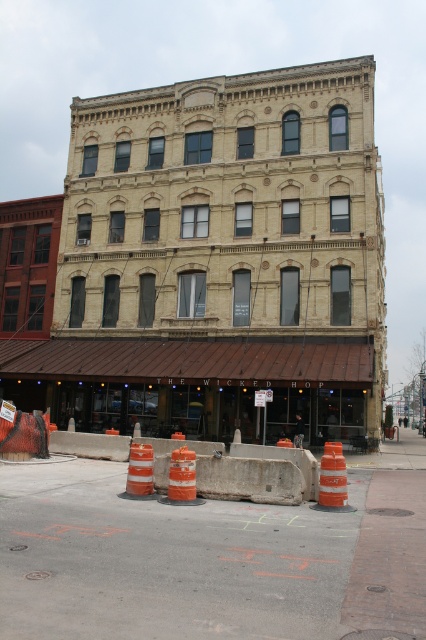
Question: Can you confirm if orange traffic cones at center is positioned to the right of orange reflective cone at center?

Choices:
 (A) no
 (B) yes

Answer: (B)

Question: Can you confirm if orange traffic cones at center is positioned above orange reflective cone at center?

Choices:
 (A) no
 (B) yes

Answer: (A)

Question: Estimate the real-world distances between objects in this image. Which object is farther from the orange reflective cone at center?

Choices:
 (A) orange traffic cones at center
 (B) concrete at center

Answer: (A)

Question: Which point is closer to the camera?

Choices:
 (A) (51, 474)
 (B) (138, 493)
 (C) (227, 486)

Answer: (B)

Question: Does orange traffic cones at center come in front of orange reflective cone at center?

Choices:
 (A) yes
 (B) no

Answer: (A)

Question: Which point is farther to the camera?

Choices:
 (A) (149, 467)
 (B) (294, 467)
 (C) (8, 544)

Answer: (A)